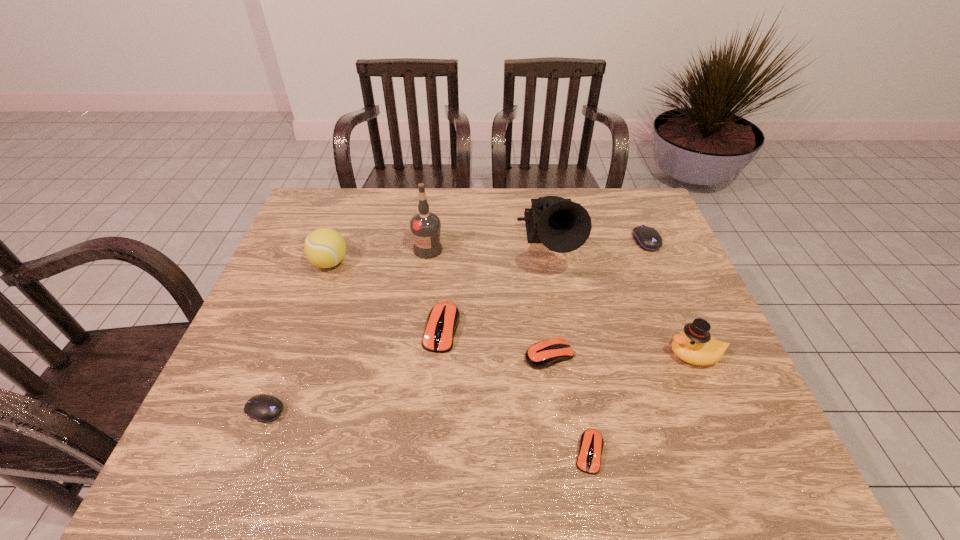
Locate an element on the screen. vacant area that satisfies the following two spatial constraints: 1. on the back side of the eighth farthest object; 2. on the left side of the tennis ball is located at coordinates coord(322,263).

I want to click on vacant space that satisfies the following two spatial constraints: 1. on the front label of the second biggest orange computer mouse; 2. on the right side of the vodka, so click(x=414, y=355).

Locate an element on the screen. vacant area that satisfies the following two spatial constraints: 1. on the front label of the nearest object; 2. on the right side of the vodka is located at coordinates (401, 453).

Find the location of a particular element. free spot that satisfies the following two spatial constraints: 1. on the back side of the bigger black computer mouse; 2. on the left side of the tennis ball is located at coordinates (338, 241).